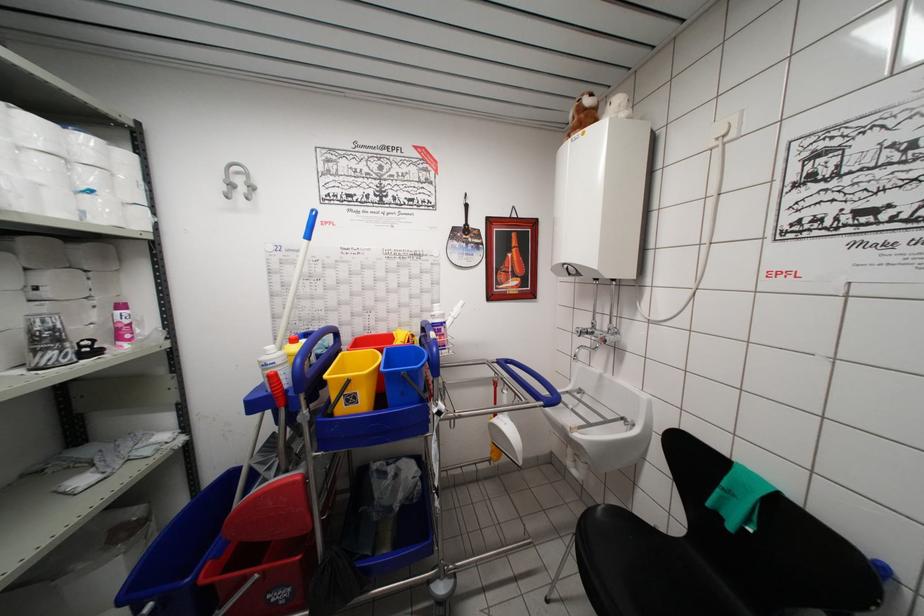
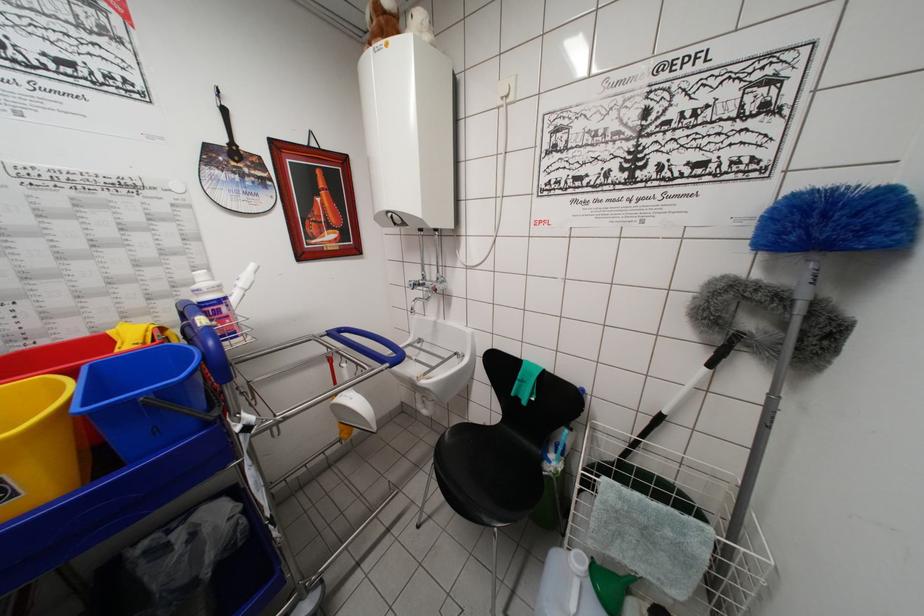
Locate, in the second image, the point that corresponds to the point at 574,434 in the first image.

(420, 383)